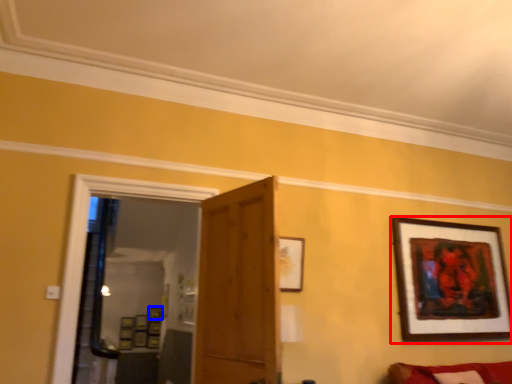
Question: Among these objects, which one is farthest to the camera, picture frame (highlighted by a red box) or picture frame (highlighted by a blue box)?

Choices:
 (A) picture frame
 (B) picture frame

Answer: (B)